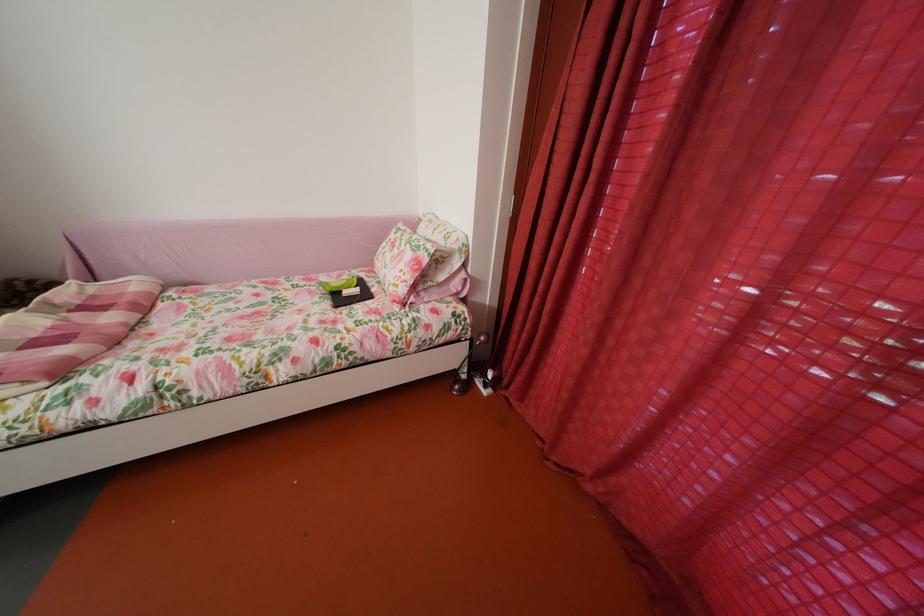
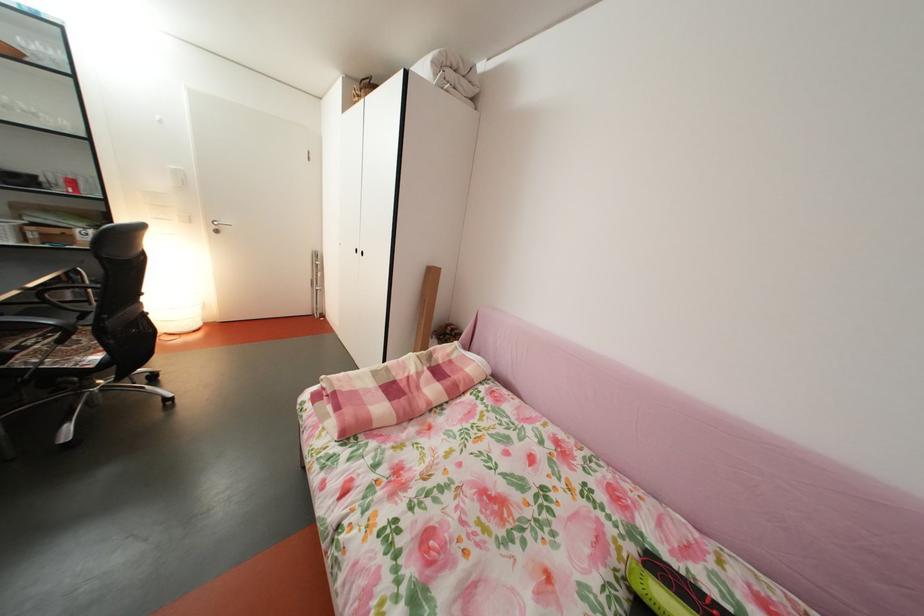
Question: The images are taken continuously from a first-person perspective. In which direction is your viewpoint rotating?

Choices:
 (A) Left
 (B) Right
 (C) Up
 (D) Down

Answer: (A)